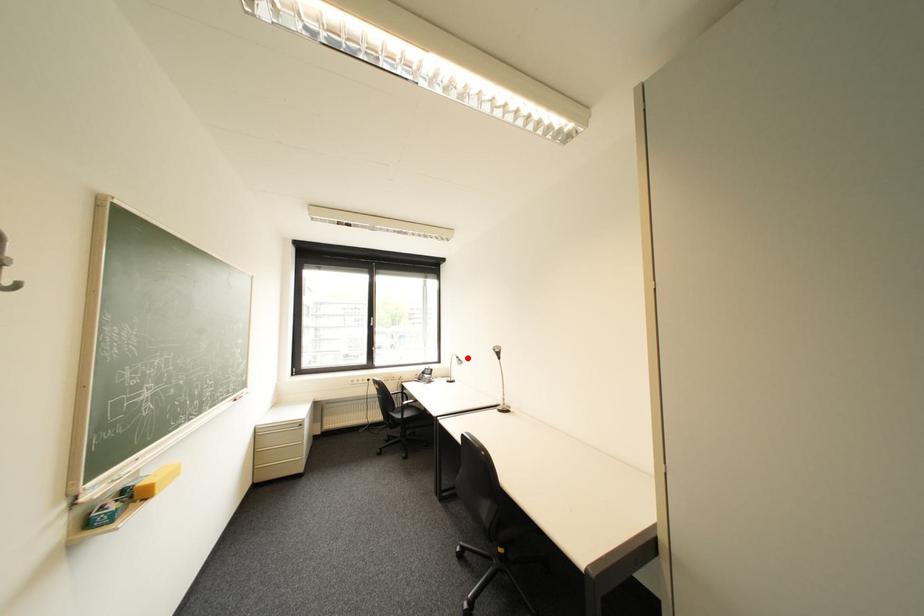
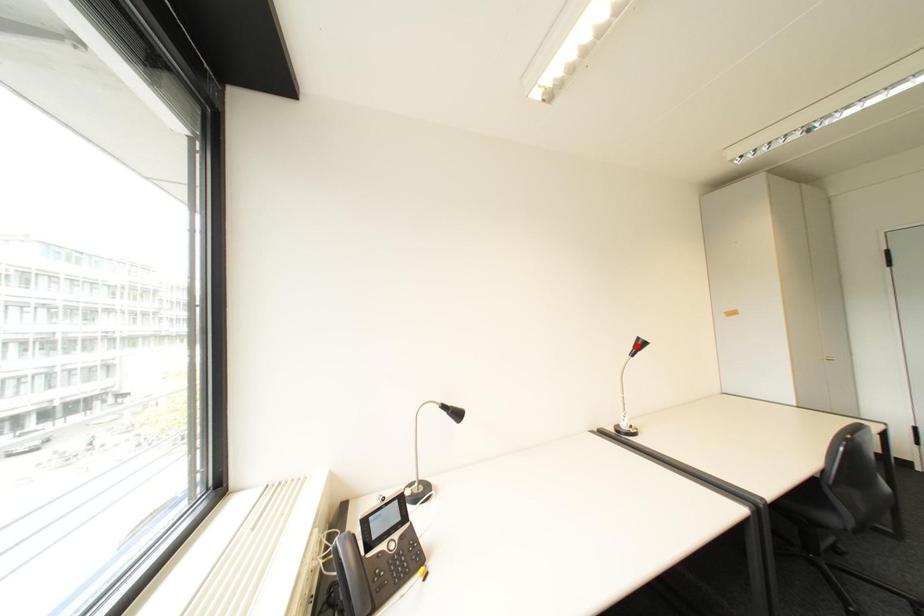
I am providing you with two images of the same scene from different viewpoints. A red point is marked on the first image and another point is marked on the second image. Are the points marked in image1 and image2 representing the same 3D position?

No